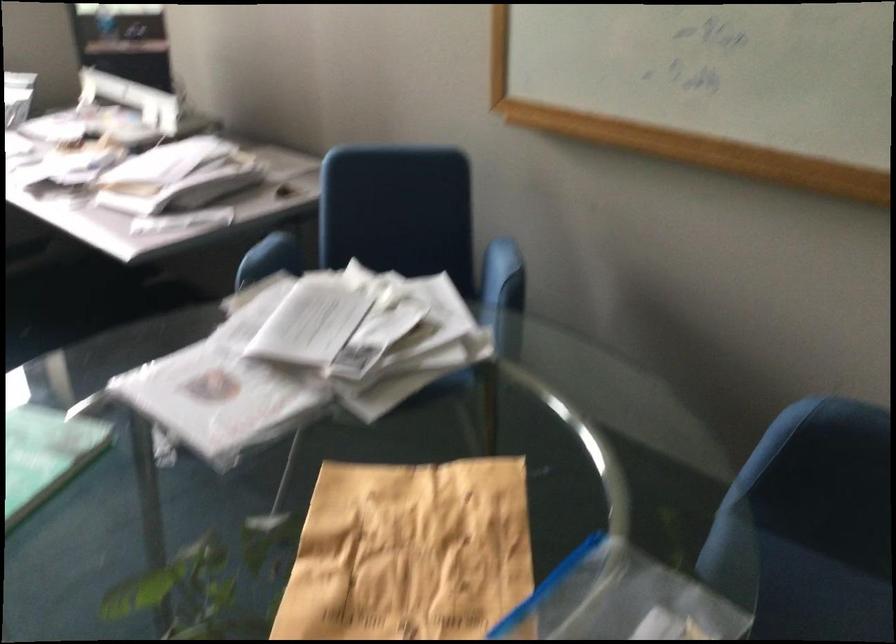
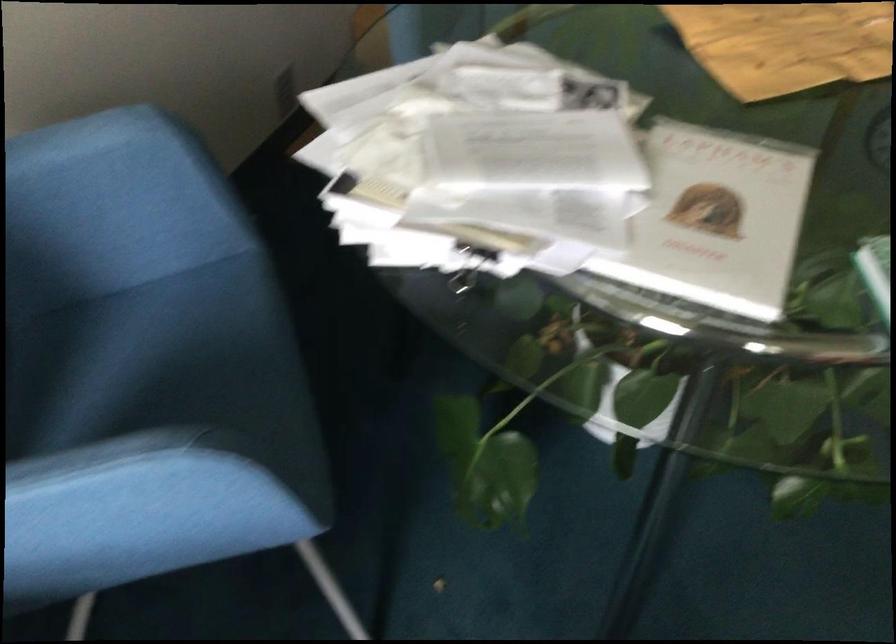
Where in the second image is the point corresponding to the point at 183,419 from the first image?

(716, 220)